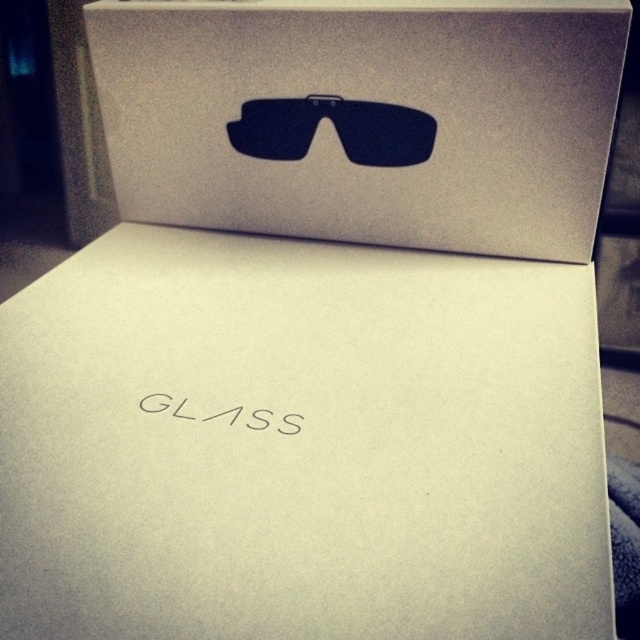
You are trying to stack the matte black goggles at center onto the white matte cardboard box at center. Based on their widths, will the goggles fit entirely on top of the box without overhanging?

The white matte cardboard box at center might be wider than matte black goggles at center, so there is a possibility that the goggles will fit without overhanging. However, the exact width difference is uncertain based on the given information.

You are standing in front of two stacked boxes. You notice two points marked on them. The first point is at coordinate point (454, 240) and the second is at point (368, 106). If you were to reach out and touch both points, which point would feel closer to your hand?

Point (454, 240) is further to the camera than point (368, 106), so the point at (368, 106) would feel closer to your hand.